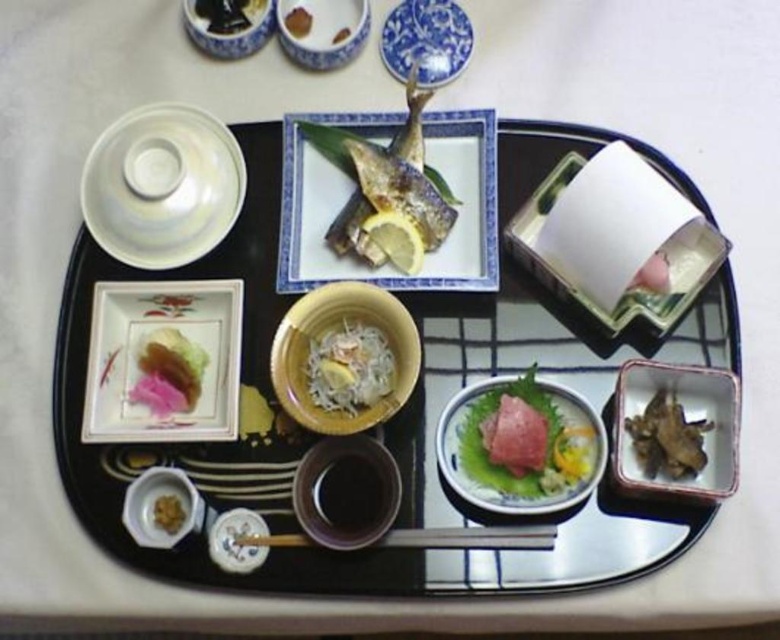
You are standing in front of the black tray with a blue rim and want to place a small spoon at two specific points on the tray. The first point is at coordinates point (100,184) and the second is at point (731,490). Which point is closer to you?

Point (100,184) is closer to you than point (731,490) because it is further to the viewer according to the description.

You are a food critic evaluating the arrangement of dishes on the black tray with a blue rim. Which object has a greater width between the white glossy bowl at upper left and the brown crumbly food at lower left?

The white glossy bowl at upper left has a greater width than the brown crumbly food at lower left.